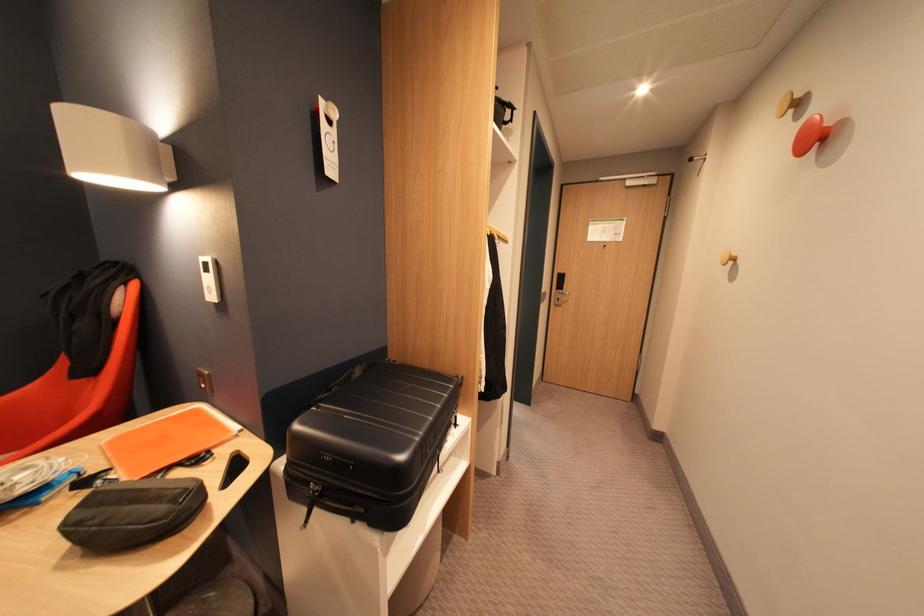
Where would you lift the orange notebook? Please return your answer as a coordinate pair (x, y).

(166, 440)